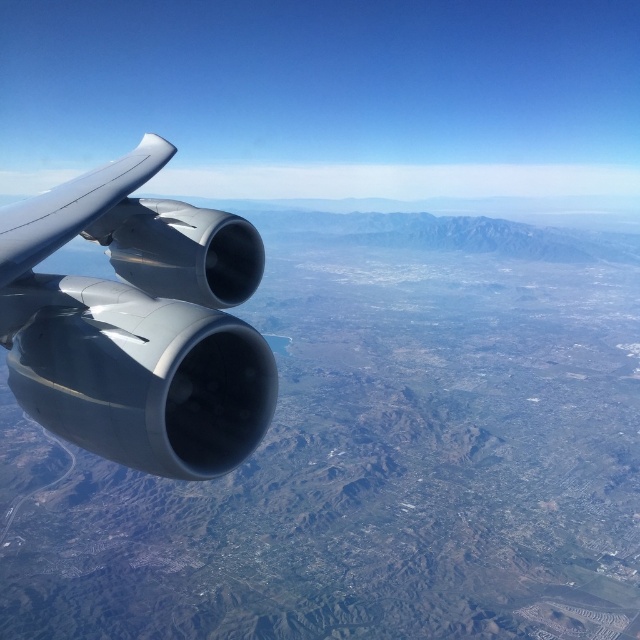
What do you see at coordinates (138, 323) in the screenshot? The image size is (640, 640). I see `matte gray engine at left` at bounding box center [138, 323].

Does matte gray engine at left appear on the left side of satin silver wing at upper left?

Incorrect, matte gray engine at left is not on the left side of satin silver wing at upper left.

The image size is (640, 640). What are the coordinates of `matte gray engine at left` in the screenshot? It's located at (138, 323).